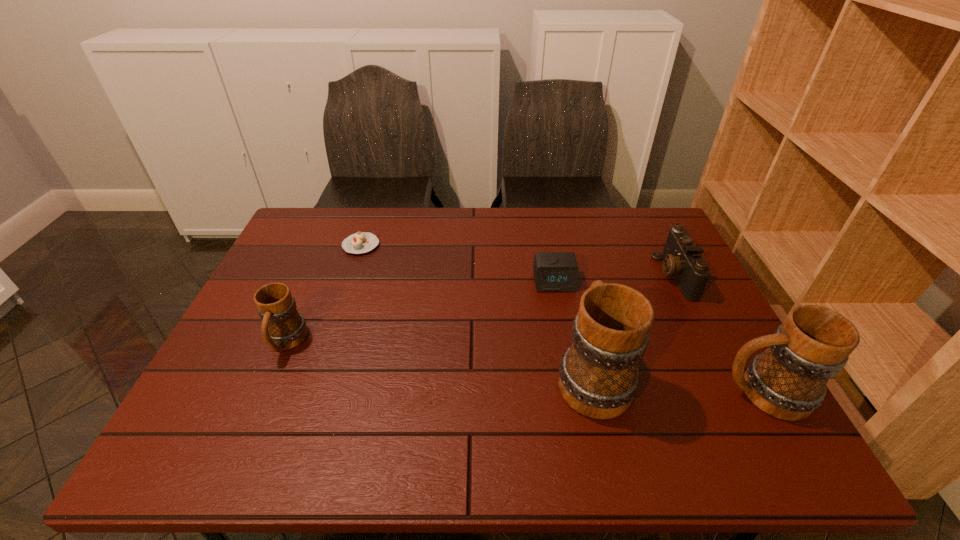
You are a GUI agent. You are given a task and a screenshot of the screen. Output one action in this format:
    pyautogui.click(x=<x>, y=<y>)
    Task: Click on the fourth shortest object
    This screenshot has width=960, height=540.
    Given the screenshot: What is the action you would take?
    pyautogui.click(x=283, y=327)

The width and height of the screenshot is (960, 540). Find the location of `the shortest mug`. the shortest mug is located at coordinates (283, 327).

This screenshot has width=960, height=540. What are the coordinates of `the second mug from left to right` in the screenshot? It's located at (599, 376).

Find the location of a particular element. The width and height of the screenshot is (960, 540). the second tallest mug is located at coordinates 787,381.

This screenshot has height=540, width=960. What are the coordinates of `the fifth shortest object` in the screenshot? It's located at (787, 381).

This screenshot has width=960, height=540. In order to click on the shortest object in this screenshot , I will do `click(361, 242)`.

You are a GUI agent. You are given a task and a screenshot of the screen. Output one action in this format:
    pyautogui.click(x=<x>, y=<y>)
    Task: Click on the camera
    The image size is (960, 540).
    Given the screenshot: What is the action you would take?
    pyautogui.click(x=682, y=259)

At what (x,y) coordinates should I click in order to perform the action: click on the fifth tallest object. Please return your answer as a coordinate pair (x, y). Image resolution: width=960 pixels, height=540 pixels. Looking at the image, I should click on (553, 271).

Locate an element on the screen. vacant space positioned 0.070m on the side of the shortest mug with the handle is located at coordinates pyautogui.click(x=266, y=389).

Image resolution: width=960 pixels, height=540 pixels. I want to click on free space located 0.080m on the side of the second mug from left to right with the handle, so click(x=578, y=313).